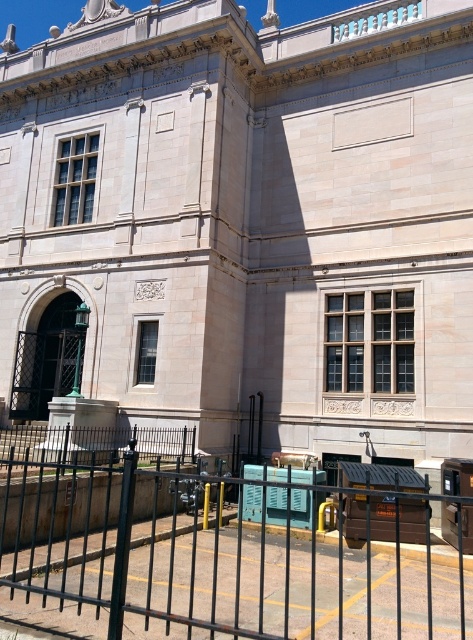
Between black metal fence at lower center and white marble clock at center, which one is positioned lower?

black metal fence at lower center

Which is behind, point (191, 500) or point (137, 289)?

The point (137, 289) is more distant.

This screenshot has height=640, width=473. Identify the location of black metal fence at lower center. (x=210, y=557).